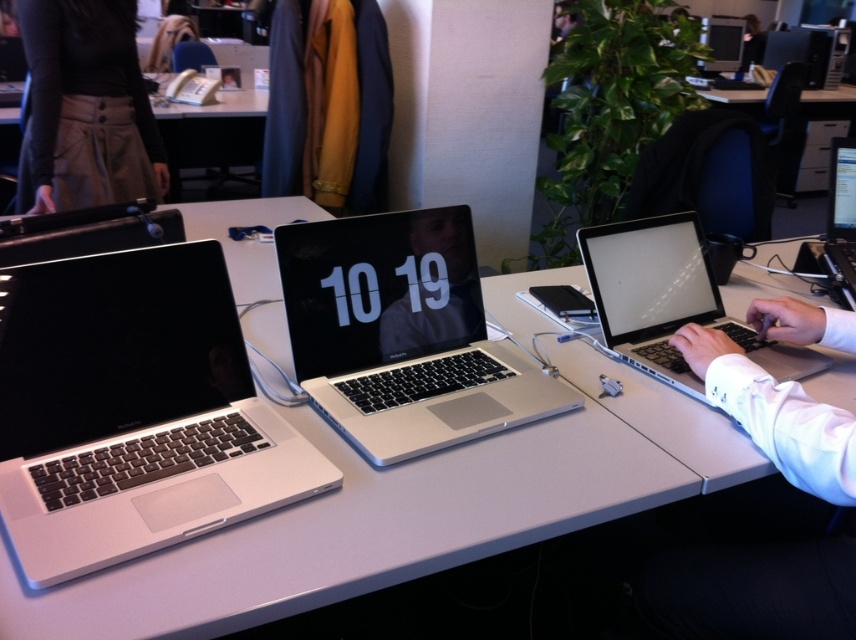
Is satin silver laptop at right positioned behind silver metallic laptop at right?

No, it is in front of silver metallic laptop at right.

Is point (687, 236) in front of point (837, 188)?

Yes, point (687, 236) is closer to viewer.

This screenshot has height=640, width=856. Identify the location of satin silver laptop at right. (670, 300).

Which is more to the left, sleek silver laptop at center or silver metallic laptop at right?

Positioned to the left is sleek silver laptop at center.

Does point (390, 372) lie behind point (836, 243)?

No.

What are the coordinates of `sleek silver laptop at center` in the screenshot? It's located at (402, 333).

The image size is (856, 640). Find the location of `sleek silver laptop at center`. sleek silver laptop at center is located at coordinates (402, 333).

Is point (143, 477) closer to viewer compared to point (28, 58)?

That is True.

Can you confirm if silver metallic laptop at left is taller than khaki cotton skirt at upper left?

Incorrect, silver metallic laptop at left's height is not larger of khaki cotton skirt at upper left's.

Locate an element on the screen. The height and width of the screenshot is (640, 856). silver metallic laptop at left is located at coordinates (132, 412).

Where is `silver metallic laptop at left`? Image resolution: width=856 pixels, height=640 pixels. silver metallic laptop at left is located at coordinates (132, 412).